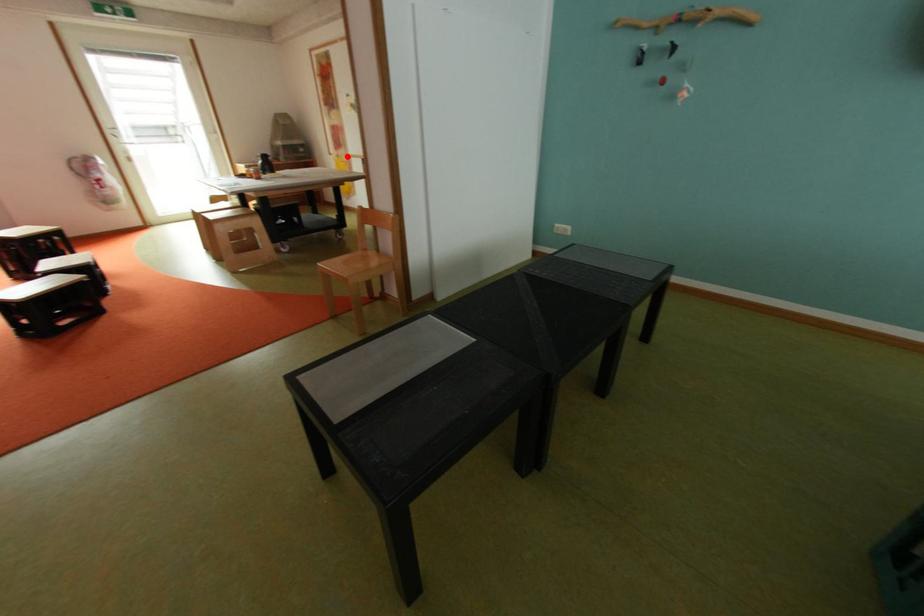
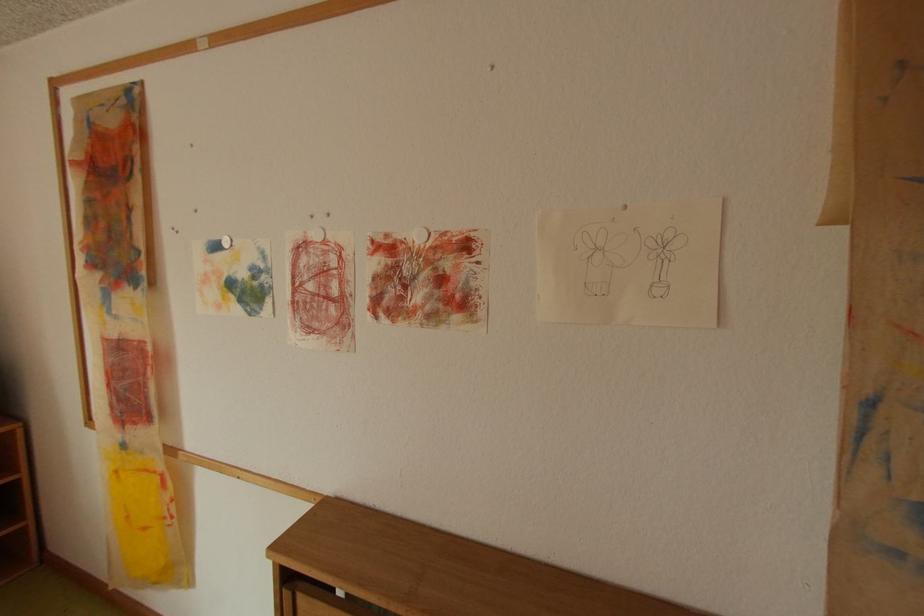
Find the pixel in the second image that matches the highlighted location in the first image.

(134, 446)